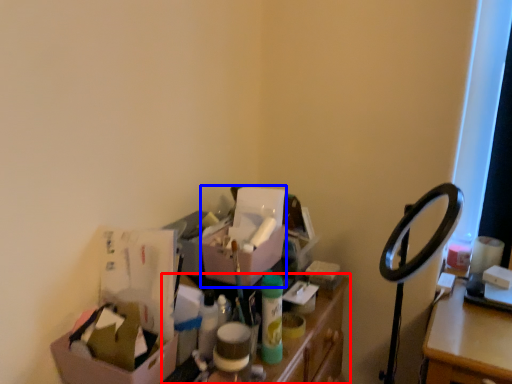
Question: Which object is further to the camera taking this photo, furniture (highlighted by a red box) or box (highlighted by a blue box)?

Choices:
 (A) furniture
 (B) box

Answer: (B)